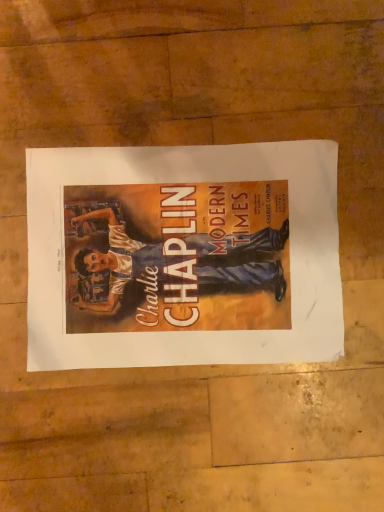
You are a GUI agent. You are given a task and a screenshot of the screen. Output one action in this format:
    pyautogui.click(x=<x>, y=<y>)
    Task: Click on the vacant area on top of matte paper poster at center (from a real-world perspective)
    The height and width of the screenshot is (512, 384).
    Given the screenshot: What is the action you would take?
    pyautogui.click(x=188, y=254)